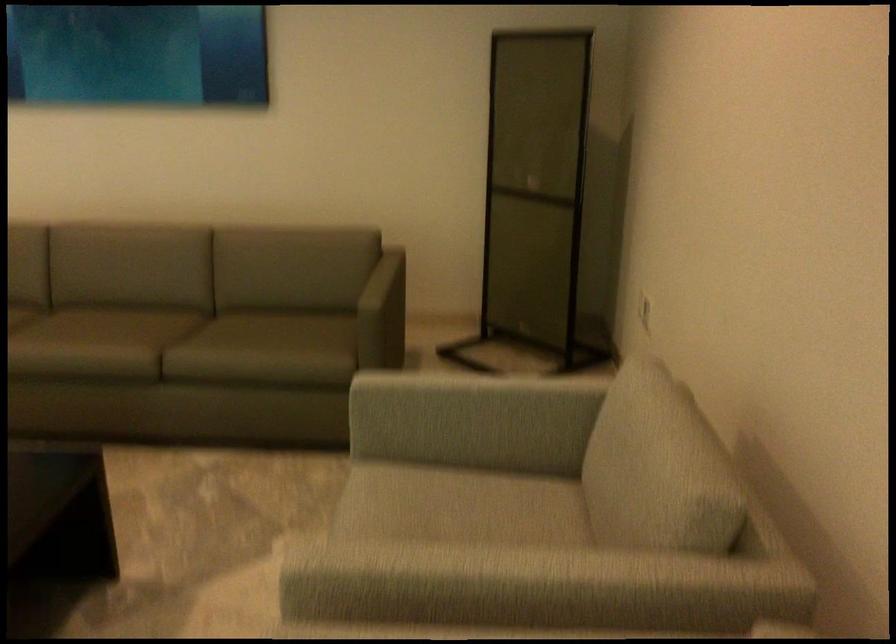
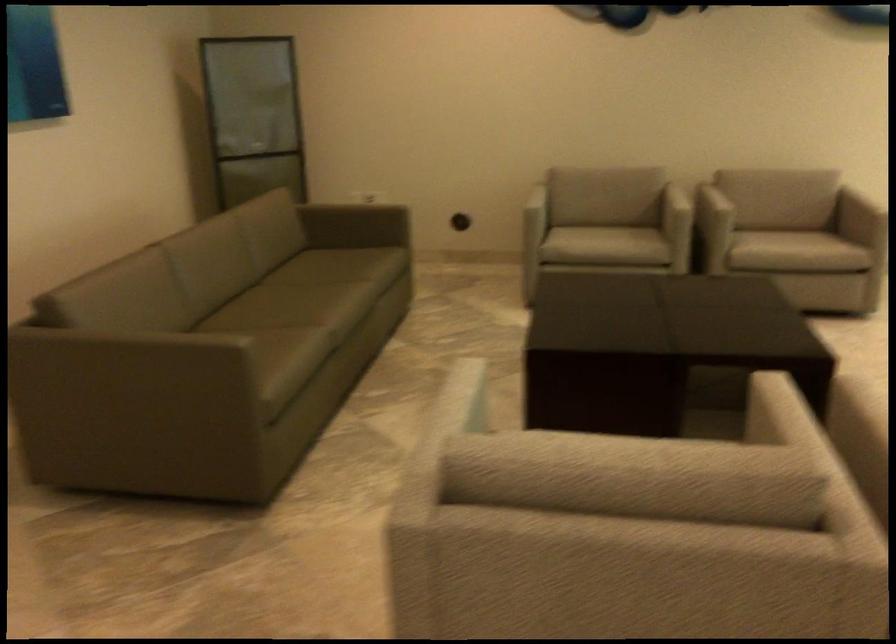
Find the pixel in the second image that matches (x=479, y=573) in the first image.

(668, 190)